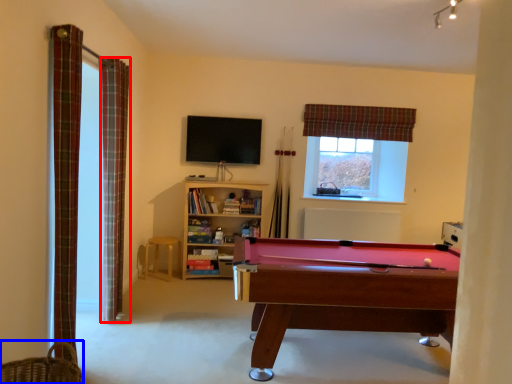
Question: Which object appears closest to the camera in this image, curtain (highlighted by a red box) or basket (highlighted by a blue box)?

Choices:
 (A) curtain
 (B) basket

Answer: (B)